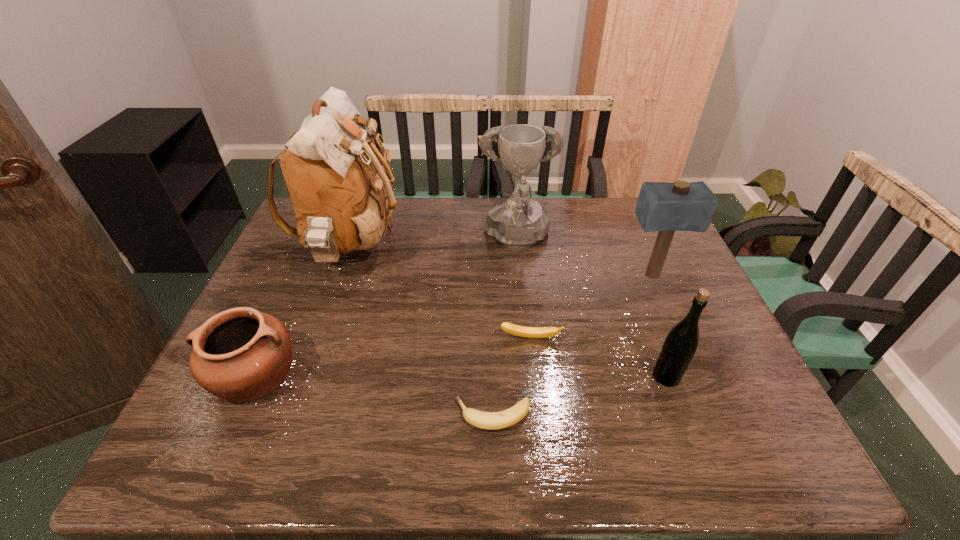
Locate an element on the screen. object located at the near edge is located at coordinates (485, 420).

The height and width of the screenshot is (540, 960). I want to click on backpack that is at the left edge, so click(342, 196).

Locate an element on the screen. pottery positioned at the left edge is located at coordinates point(239,355).

Identify the location of mallet that is at the right edge. (681, 206).

Find the location of a particular element. The height and width of the screenshot is (540, 960). beer bottle that is at the right edge is located at coordinates (680, 345).

Locate an element on the screen. The image size is (960, 540). object present at the far left corner is located at coordinates (342, 196).

Find the location of a particular element. This screenshot has width=960, height=540. free space at the far edge of the desktop is located at coordinates (433, 211).

Where is `free region at the near edge`? The width and height of the screenshot is (960, 540). free region at the near edge is located at coordinates (333, 431).

This screenshot has height=540, width=960. What are the coordinates of `free point at the right edge` in the screenshot? It's located at (689, 275).

I want to click on vacant space at the near left corner, so click(218, 444).